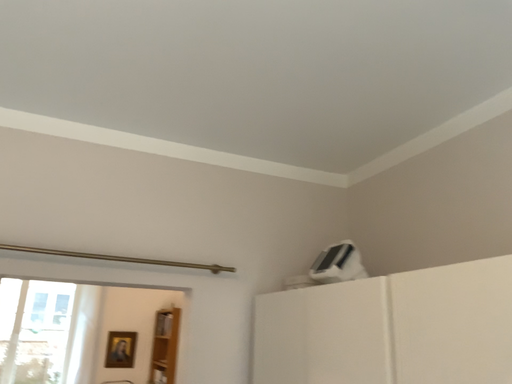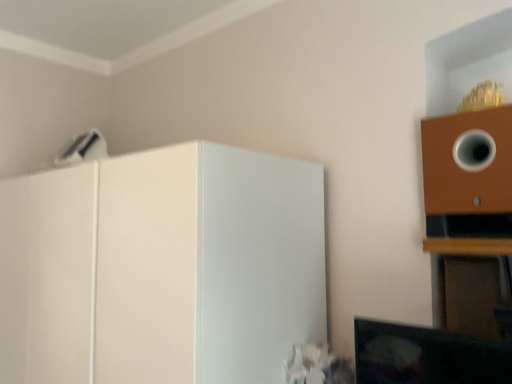
Question: How did the camera likely rotate when shooting the video?

Choices:
 (A) rotated left
 (B) rotated right

Answer: (B)